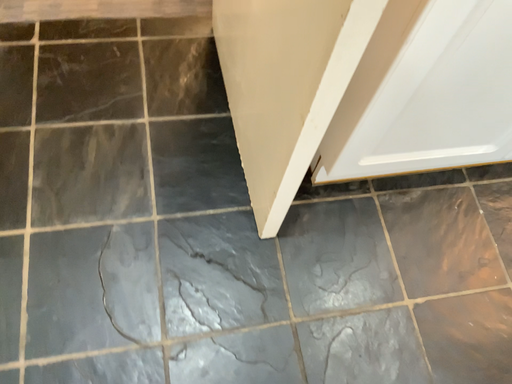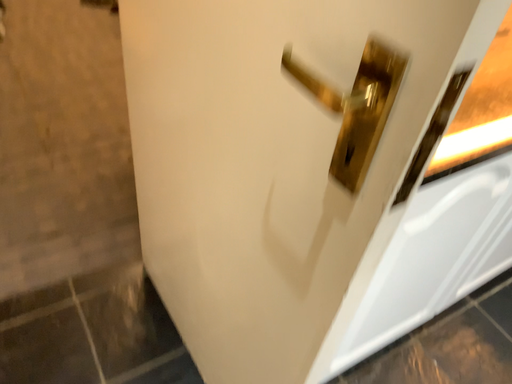
Question: How did the camera likely rotate when shooting the video?

Choices:
 (A) rotated right
 (B) rotated left

Answer: (A)